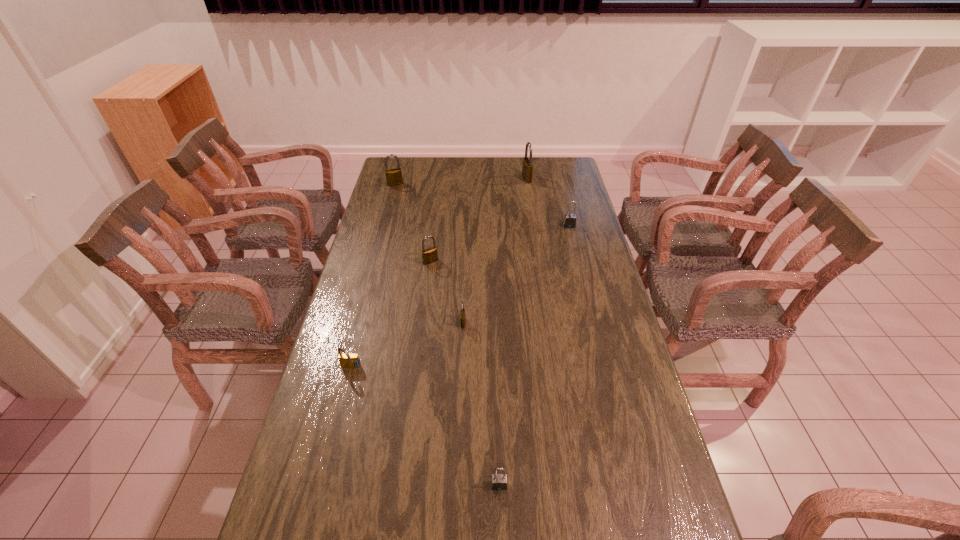
Locate an element on the screen. This screenshot has height=540, width=960. object at the far edge is located at coordinates (527, 168).

Locate an element on the screen. The height and width of the screenshot is (540, 960). object that is at the right edge is located at coordinates (569, 221).

Find the location of a particular element. vacant space at the far edge is located at coordinates (485, 178).

This screenshot has height=540, width=960. What are the coordinates of `vacant space at the left edge of the desktop` in the screenshot? It's located at (396, 251).

The height and width of the screenshot is (540, 960). In the image, there is a desktop. Find the location of `free space at the right edge`. free space at the right edge is located at coordinates (620, 311).

Locate an element on the screen. vacant area between the third padlock from left to right and the rightmost object is located at coordinates 499,244.

Where is `free space between the third farthest object and the third nearest padlock`? free space between the third farthest object and the third nearest padlock is located at coordinates (516, 274).

Identify the location of unoccupied area between the tallest padlock and the fifth farthest padlock. (494, 251).

Image resolution: width=960 pixels, height=540 pixels. Identify the location of empty location between the sixth shortest object and the second nearest padlock. (373, 276).

Find the location of a particular element. This screenshot has width=960, height=540. vacant area that lies between the fifth padlock from left to right and the bigger gray padlock is located at coordinates tap(534, 355).